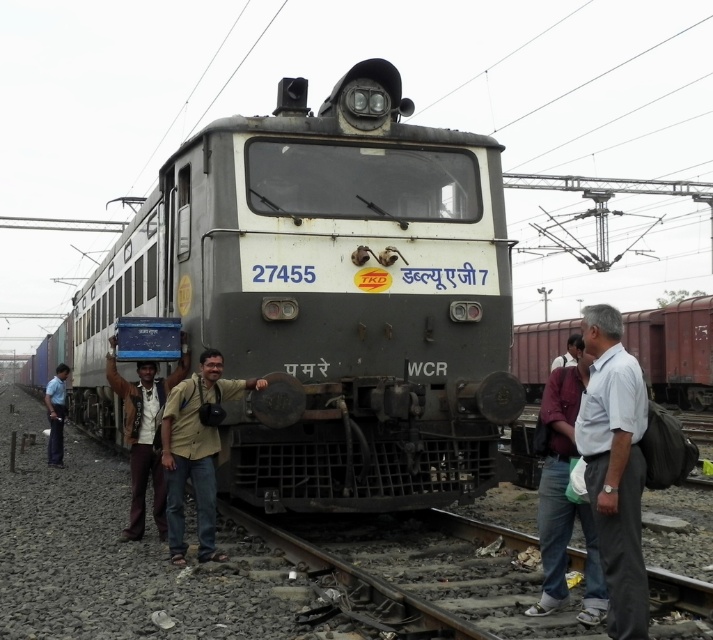
You are a photographer standing at the railway station and want to take a photo of the beige fabric shirt at center. Where should you position yourself to capture the shirt in the center of your photo?

To capture the beige fabric shirt at center in the center of your photo, position yourself directly in front of the shirt at the coordinates specified by the point (195, 451), ensuring the shirt is centered in your camera viewfinder.

You are a photographer at the railway station and want to capture a photo of the locomotive. You notice two people in the foreground wearing a beige fabric shirt at center and a dark gray shirt at center. Which person should you ask to move aside so that the locomotive is fully visible in your photo?

You should ask the person wearing the dark gray shirt at center to move aside because the beige fabric shirt at center is thinner than the dark gray shirt at center, meaning the dark gray shirt at center is wider and blocking more of the locomotive.

You are a photographer at the railway station. You want to take a photo of the beige fabric shirt at center and the dark blue jeans at lower left. Which clothing item is narrower in width?

The beige fabric shirt at center is narrower in width than the dark blue jeans at lower left.